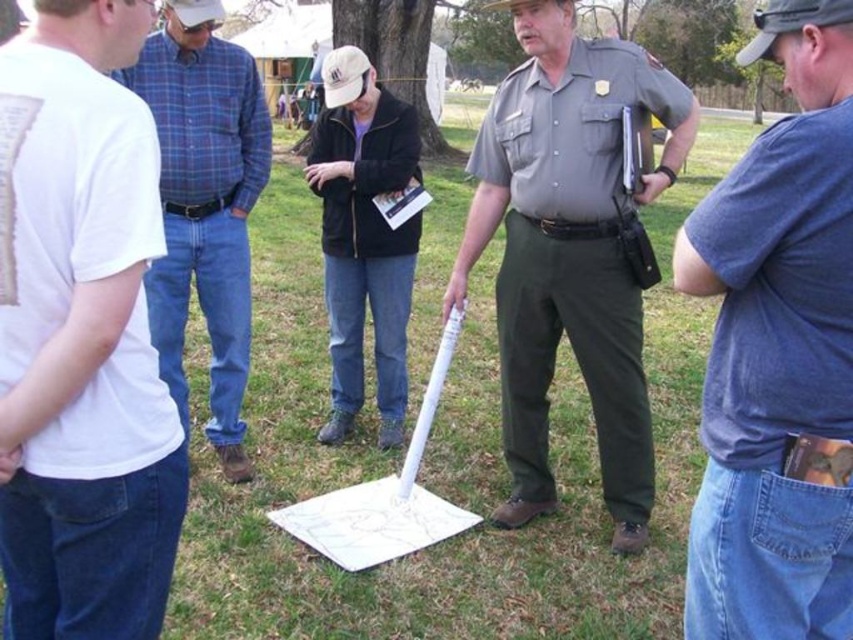
Question: Is blue denim jeans at lower right thinner than black matte jacket at center?

Choices:
 (A) no
 (B) yes

Answer: (B)

Question: Among these objects, which one is nearest to the camera?

Choices:
 (A) blue denim jeans at lower right
 (B) blue plaid shirt at left
 (C) white t-shirt at left
 (D) black matte jacket at center

Answer: (C)

Question: Is the position of white t-shirt at left more distant than that of black matte jacket at center?

Choices:
 (A) yes
 (B) no

Answer: (B)

Question: In this image, where is white t-shirt at left located relative to blue plaid shirt at left?

Choices:
 (A) above
 (B) below

Answer: (B)

Question: Estimate the real-world distances between objects in this image. Which object is farther from the black matte jacket at center?

Choices:
 (A) blue plaid shirt at left
 (B) blue denim jeans at lower right

Answer: (B)

Question: Based on their relative distances, which object is nearer to the black matte jacket at center?

Choices:
 (A) gray uniformed officer at center
 (B) blue denim jeans at lower right

Answer: (A)